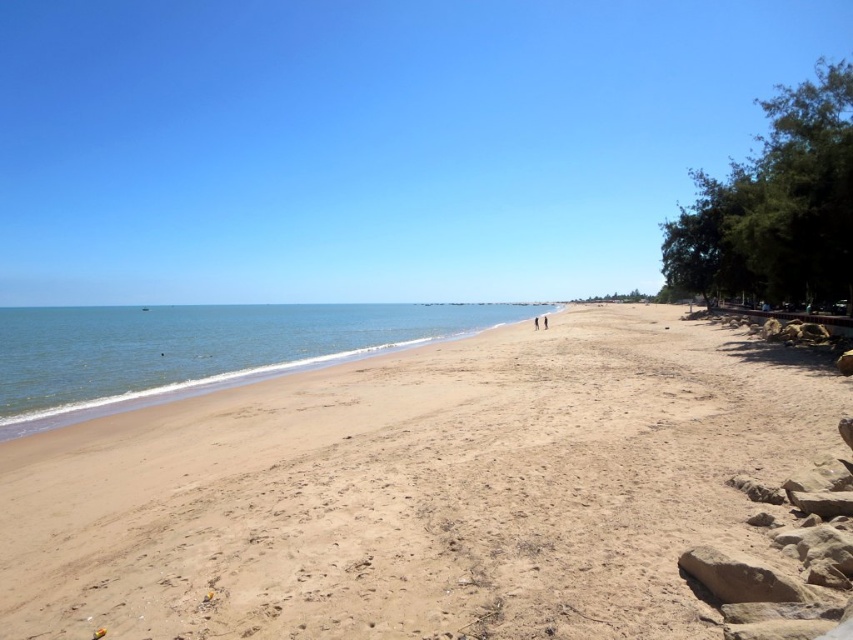
You are standing at the camera position and want to reach the point marked as point (299, 620) on the beach. If you walk straight ahead, will you reach that point before walking 5 meters?

The distance between you and point (299, 620) is 4.26 meters, so yes, you will reach the point before walking 5 meters.

You are standing on the beach and see the light brown sand at center and the skinny jeans at center. Which object is positioned to the left of the other?

The light brown sand at center is to the left of the skinny jeans at center.

You are standing on the beach and see the blue water at left and the skinny jeans at center. Which object is closer to your left side?

The blue water at left is closer to your left side because it is positioned to the left of the skinny jeans at center.